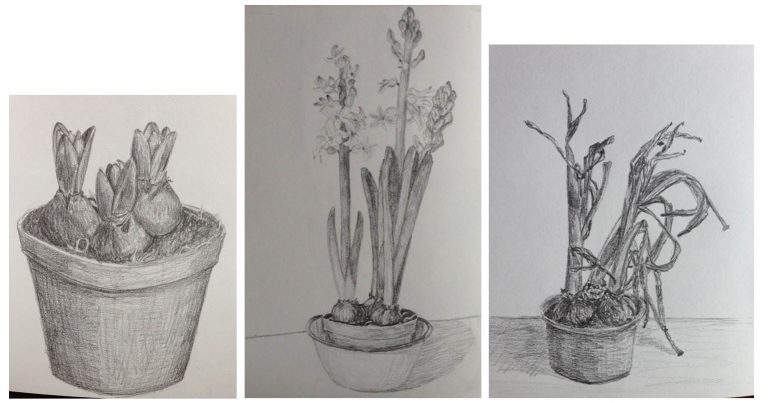
The height and width of the screenshot is (403, 768). I want to click on flower pot, so click(91, 319), click(388, 340), click(580, 348).